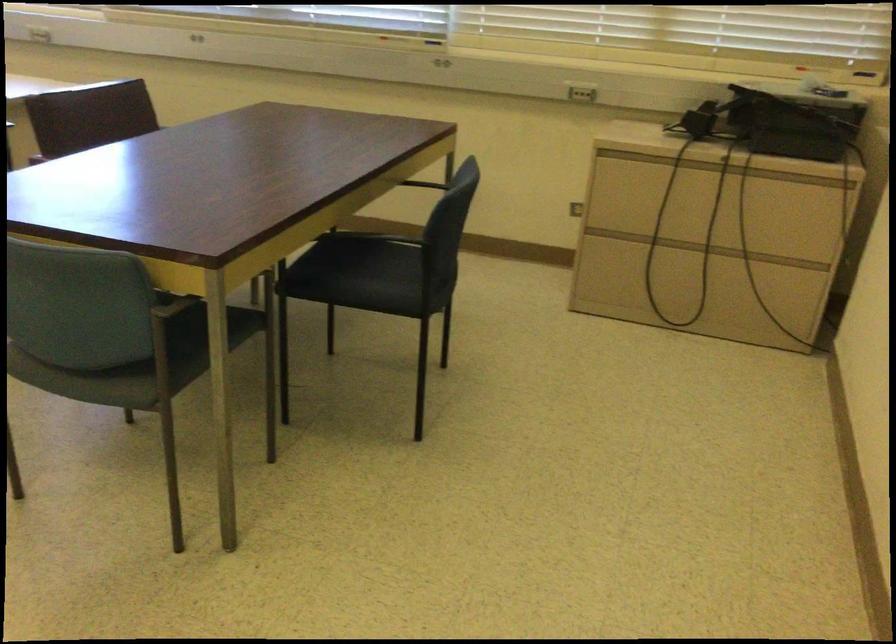
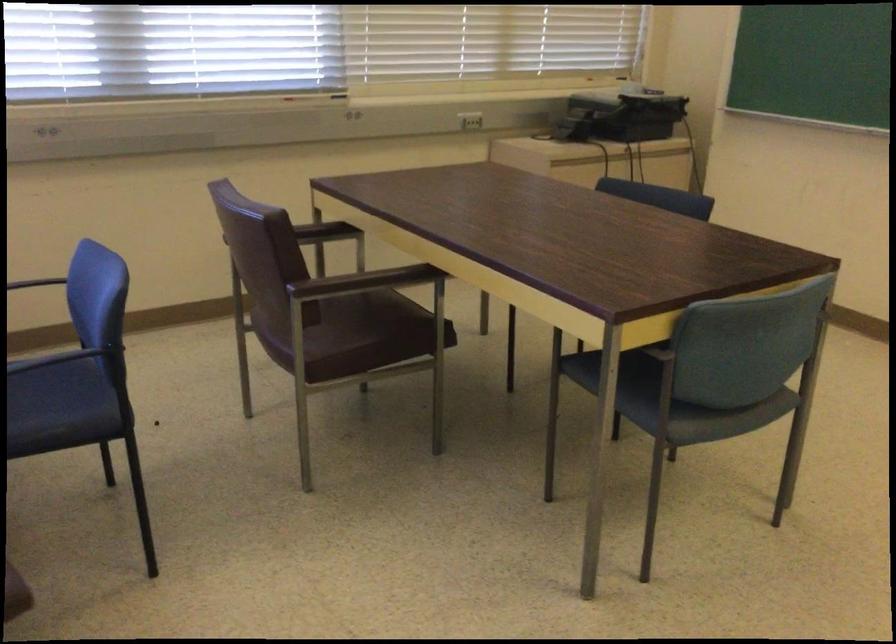
Question: I am providing you with two images of the same scene from different viewpoints. Please identify which objects are invisible in image2.

Choices:
 (A) black cylindrical object
 (B) black chair sitting surface
 (C) dark blue sitting surface
 (D) brown chair armrest

Answer: (B)